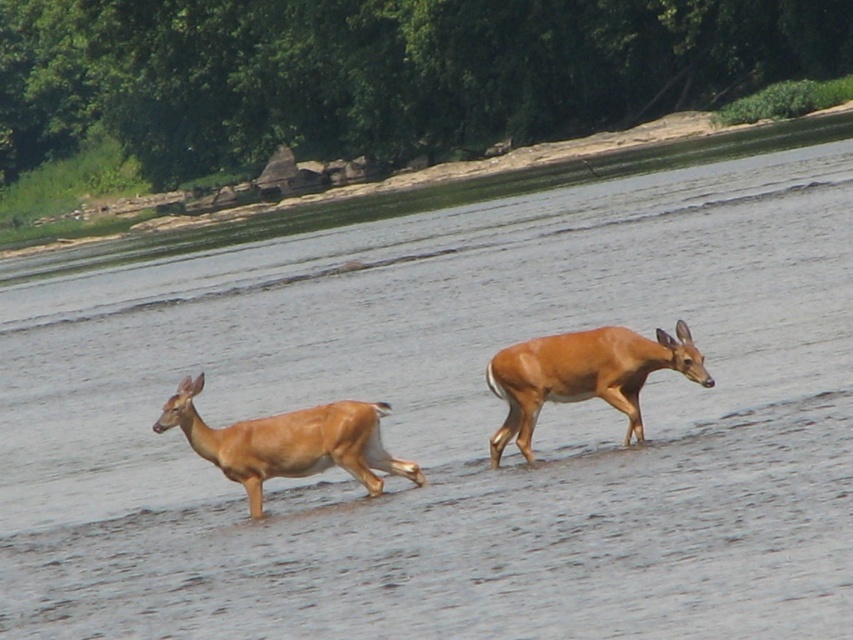
Question: Is the position of shiny brown deer at center less distant than that of light brown fur deer at center?

Choices:
 (A) no
 (B) yes

Answer: (B)

Question: Can you confirm if shiny brown deer at center is positioned to the right of light brown fur deer at center?

Choices:
 (A) no
 (B) yes

Answer: (B)

Question: Which point appears closest to the camera in this image?

Choices:
 (A) (602, 397)
 (B) (390, 456)

Answer: (B)

Question: Among these points, which one is farthest from the camera?

Choices:
 (A) (258, 481)
 (B) (492, 444)

Answer: (B)

Question: Can you confirm if shiny brown deer at center is positioned below light brown fur deer at center?

Choices:
 (A) yes
 (B) no

Answer: (B)

Question: Which point is farther to the camera?

Choices:
 (A) shiny brown deer at center
 (B) light brown fur deer at center

Answer: (B)